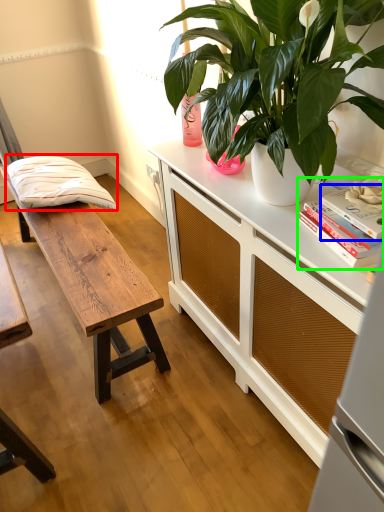
Question: Which object is positioned farthest from pillow (highlighted by a red box)? Select from book (highlighted by a blue box) and book (highlighted by a green box).

Choices:
 (A) book
 (B) book

Answer: (A)